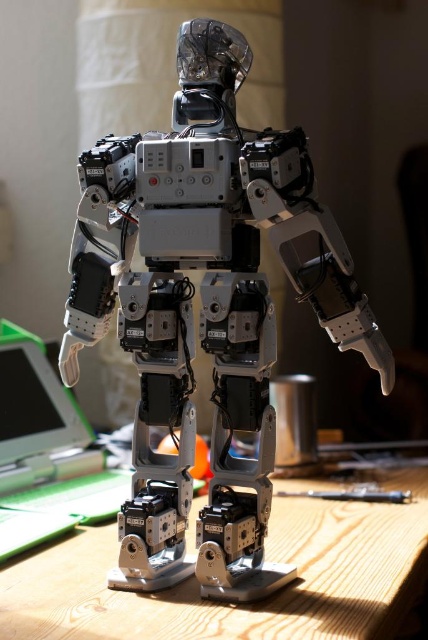
Is the position of metallic silver robot at center less distant than that of wooden table at lower center?

No, metallic silver robot at center is further to the viewer.

Does metallic silver robot at center have a greater width compared to wooden table at lower center?

In fact, metallic silver robot at center might be narrower than wooden table at lower center.

Does point (196, 259) come closer to viewer compared to point (329, 483)?

Yes, point (196, 259) is closer to viewer.

Identify the location of metallic silver robot at center. This screenshot has height=640, width=428. (x=205, y=310).